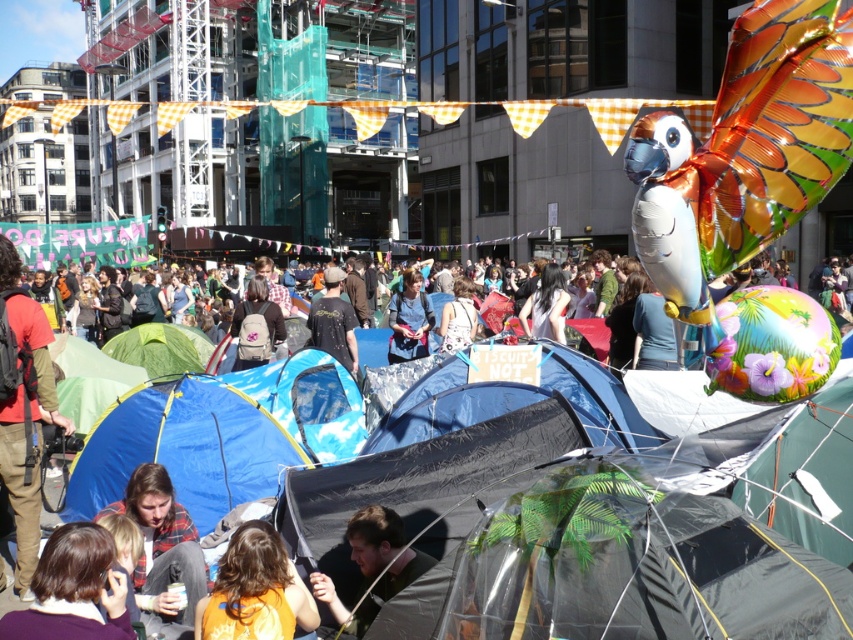
You are a participant in the protest and want to take a photo of the holographic floral balloon at upper right. You have a camera with a 50mm lens. Knowing that the balloon is 1.2 meters tall, can you estimate if the balloon will fill the frame vertically? Assume the camera sensor has a height of 24mm and the frame height is 6cm when viewed from your current position.

The holographic floral balloon at upper right is 17.11 meters away from the viewer. Using the lens formula, the angle of view for a 50mm lens on a 24mm sensor is approximately 27 degrees. The balloon is 1.2 meters tall and 17.11 meters away, so its angular size is about 4 degrees. Since 4 degrees is smaller than the 27 degree field of view, the balloon will not fill the frame vertically.